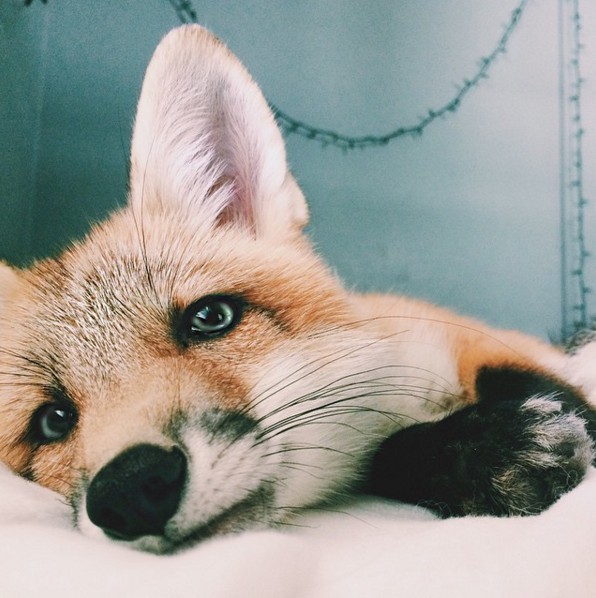
Image resolution: width=596 pixels, height=598 pixels. In order to click on wall background in this screenshot , I will do `click(484, 185)`.